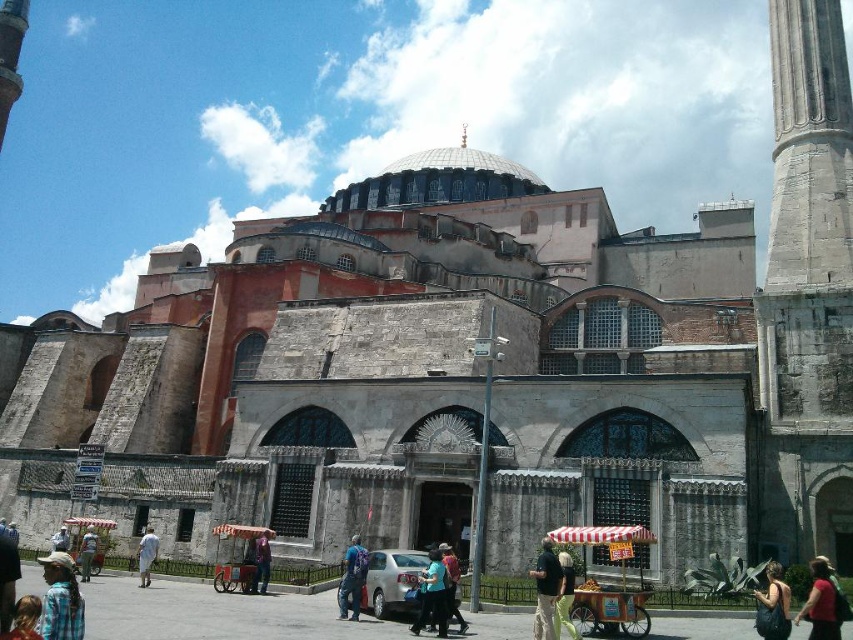
Does dark brown leather handbag at lower right appear over light blue fabric shirt at center?

Indeed, dark brown leather handbag at lower right is positioned over light blue fabric shirt at center.

Based on the photo, can you confirm if dark brown leather handbag at lower right is thinner than light blue fabric shirt at center?

No, dark brown leather handbag at lower right is not thinner than light blue fabric shirt at center.

Where is `dark brown leather handbag at lower right`? This screenshot has width=853, height=640. dark brown leather handbag at lower right is located at coordinates (773, 605).

Which of these two, green fabric pants at lower center or light blue denim shirt at lower left, stands taller?

Standing taller between the two is green fabric pants at lower center.

Which is in front, point (561, 579) or point (86, 540)?

Positioned in front is point (561, 579).

You are a GUI agent. You are given a task and a screenshot of the screen. Output one action in this format:
    pyautogui.click(x=<x>, y=<y>)
    Task: Click on the green fabric pants at lower center
    
    Given the screenshot: What is the action you would take?
    pyautogui.click(x=566, y=596)

Does denim jacket at lower left come behind green fabric pants at lower center?

No.

Is point (57, 636) less distant than point (561, 561)?

Yes, it is in front of point (561, 561).

Image resolution: width=853 pixels, height=640 pixels. Describe the element at coordinates (61, 600) in the screenshot. I see `denim jacket at lower left` at that location.

Locate an element on the screen. The width and height of the screenshot is (853, 640). denim jacket at lower left is located at coordinates coord(61,600).